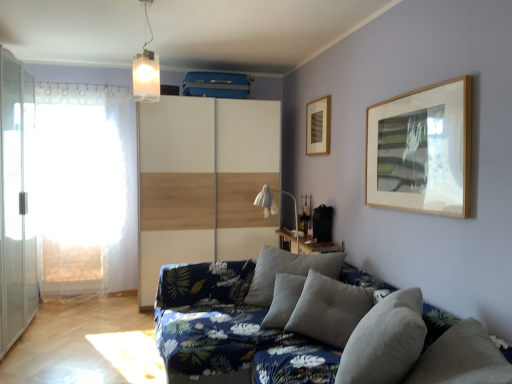
Describe the element at coordinates (275, 205) in the screenshot. The image size is (512, 384). I see `white fabric table lamp at center` at that location.

The width and height of the screenshot is (512, 384). What do you see at coordinates (304, 321) in the screenshot?
I see `textured gray cushions at lower right` at bounding box center [304, 321].

Based on the photo, what is the approximate width of white lace curtain at left?

white lace curtain at left is 10.69 inches in width.

Identify the location of wooden picture frame at upper center. (318, 126).

Between transparent glass screen door at left and white matte rectangular light fixture at upper center, which one is positioned in front?

white matte rectangular light fixture at upper center is in front.

Which is correct: transparent glass screen door at left is inside white matte rectangular light fixture at upper center, or outside of it?

transparent glass screen door at left cannot be found inside white matte rectangular light fixture at upper center.

Which is behind, white wood dresser at center or wooden table at center?

white wood dresser at center is more distant.

How distant is white wood dresser at center from wooden table at center?

white wood dresser at center and wooden table at center are 38.98 inches apart from each other.

Is point (180, 98) closer or farther from the camera than point (342, 247)?

Point (180, 98) is positioned farther from the camera compared to point (342, 247).

Considering the positions of objects white fabric table lamp at center and wooden picture frame at upper center in the image provided, who is more to the right, white fabric table lamp at center or wooden picture frame at upper center?

From the viewer's perspective, wooden picture frame at upper center appears more on the right side.

Does point (280, 190) appear closer or farther from the camera than point (310, 142)?

Clearly, point (280, 190) is more distant from the camera than point (310, 142).

Is white fabric table lamp at center not within wooden picture frame at upper center?

That's correct, white fabric table lamp at center is outside of wooden picture frame at upper center.

Is white fabric table lamp at center directly adjacent to wooden picture frame at upper center?

No, white fabric table lamp at center is not making contact with wooden picture frame at upper center.

Does wooden table at center come behind white fabric table lamp at center?

Yes, wooden table at center is further from the camera.

In order to click on table below the white fabric table lamp at center (from a real-world perspective) in this screenshot , I will do `click(306, 244)`.

Considering the relative positions of wooden table at center and white fabric table lamp at center in the image provided, is wooden table at center to the left of white fabric table lamp at center from the viewer's perspective?

Incorrect, wooden table at center is not on the left side of white fabric table lamp at center.

Looking at this image, who is taller, white lace curtain at left or wooden picture frame at upper center?

Standing taller between the two is white lace curtain at left.

Identify the location of picture frame above the white lace curtain at left (from a real-world perspective). The width and height of the screenshot is (512, 384). (318, 126).

From the image's perspective, is white lace curtain at left below wooden picture frame at upper center?

Correct, white lace curtain at left appears lower than wooden picture frame at upper center in the image.

Is white lace curtain at left facing towards wooden picture frame at upper center?

No, white lace curtain at left does not turn towards wooden picture frame at upper center.

How different are the orientations of textured gray cushions at lower right and white lace curtain at left in degrees?

The angular difference between textured gray cushions at lower right and white lace curtain at left is 92 degrees.

Is textured gray cushions at lower right bigger or smaller than white lace curtain at left?

textured gray cushions at lower right is bigger than white lace curtain at left.

Which object is wider, textured gray cushions at lower right or white lace curtain at left?

textured gray cushions at lower right.

Is textured gray cushions at lower right positioned beyond the bounds of white lace curtain at left?

textured gray cushions at lower right is positioned outside white lace curtain at left.

Considering the relative positions of transparent glass screen door at left and white lace curtain at left in the image provided, is transparent glass screen door at left in front of white lace curtain at left?

Yes, transparent glass screen door at left is in front of white lace curtain at left.

Does point (17, 116) appear closer or farther from the camera than point (100, 122)?

Point (17, 116) is positioned closer to the camera compared to point (100, 122).

Is transparent glass screen door at left facing away from white lace curtain at left?

transparent glass screen door at left does not have its back to white lace curtain at left.

Where is `screen door beneath the white matte rectangular light fixture at upper center (from a real-world perspective)`? screen door beneath the white matte rectangular light fixture at upper center (from a real-world perspective) is located at coordinates (17, 200).

In the image, there is a wooden table at center. Where is `dresser above it (from the image's perspective)`? The width and height of the screenshot is (512, 384). dresser above it (from the image's perspective) is located at coordinates (204, 182).

Considering their positions, is white matte rectangular light fixture at upper center positioned further to white lace curtain at left than transparent glass screen door at left?

white matte rectangular light fixture at upper center is further to white lace curtain at left.

Based on their spatial positions, is white lace curtain at left or wooden table at center closer to transparent glass screen door at left?

Among the two, white lace curtain at left is located nearer to transparent glass screen door at left.

From the image, which object appears to be nearer to white lace curtain at left, wooden picture frame at upper center or wooden table at center?

The object closer to white lace curtain at left is wooden table at center.

Which object lies further to the anchor point white lace curtain at left, white matte rectangular light fixture at upper center or wooden table at center?

Based on the image, wooden table at center appears to be further to white lace curtain at left.

Considering their positions, is white wood dresser at center positioned further to white matte rectangular light fixture at upper center than textured gray cushions at lower right?

Among the two, textured gray cushions at lower right is located further to white matte rectangular light fixture at upper center.

In the scene shown: Considering their positions, is white fabric table lamp at center positioned further to wooden picture frame at upper center than transparent glass screen door at left?

transparent glass screen door at left is further to wooden picture frame at upper center.

Which object lies nearer to the anchor point textured gray cushions at lower right, white fabric table lamp at center or gray fabric pillow at lower right?

The object closer to textured gray cushions at lower right is gray fabric pillow at lower right.

Based on the photo, when comparing their distances from white wood dresser at center, does white fabric table lamp at center or textured gray cushions at lower right seem closer?

The object closer to white wood dresser at center is white fabric table lamp at center.

At what (x,y) coordinates should I click in order to perform the action: click on light fixture located between white lace curtain at left and white fabric table lamp at center in the left-right direction. Please return your answer as a coordinate pair (x, y). The image size is (512, 384). Looking at the image, I should click on (146, 70).

Where is `table situated between white lace curtain at left and wooden picture frame at upper center from left to right`? The width and height of the screenshot is (512, 384). table situated between white lace curtain at left and wooden picture frame at upper center from left to right is located at coordinates (306, 244).

At what (x,y) coordinates should I click in order to perform the action: click on dresser between white lace curtain at left and white fabric table lamp at center from left to right. Please return your answer as a coordinate pair (x, y). This screenshot has width=512, height=384. Looking at the image, I should click on [x=204, y=182].

This screenshot has height=384, width=512. Find the location of `pillow between textured gray cushions at lower right and white lace curtain at left along the z-axis`. pillow between textured gray cushions at lower right and white lace curtain at left along the z-axis is located at coordinates (385, 341).